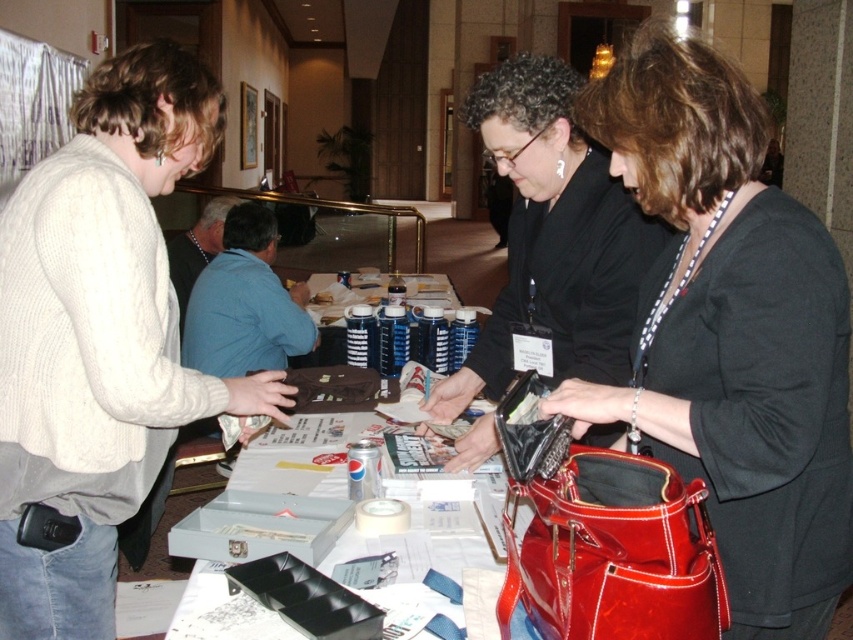
You are a security guard in the conference room. You see the black leather purse at center and the white paper at center. Which item is closer to the right side of the table?

The black leather purse at center is closer to the right side of the table because it is positioned to the right of the white paper at center.

You are a security guard in the conference room and need to determine which item is taller between the shiny patent leather handbag at center and the black leather purse at center. Which one is taller?

The shiny patent leather handbag at center is much taller than the black leather purse at center, so the shiny patent leather handbag at center is taller.